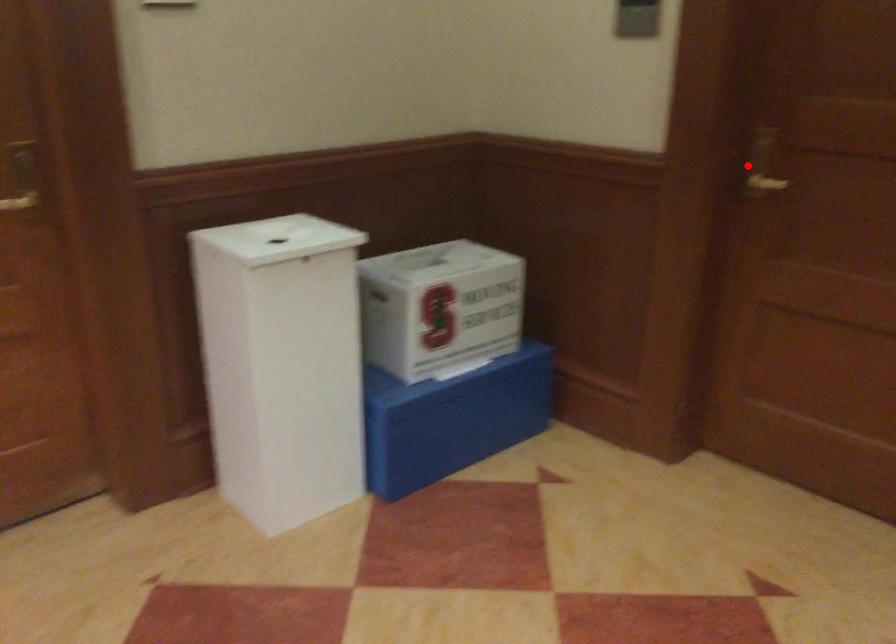
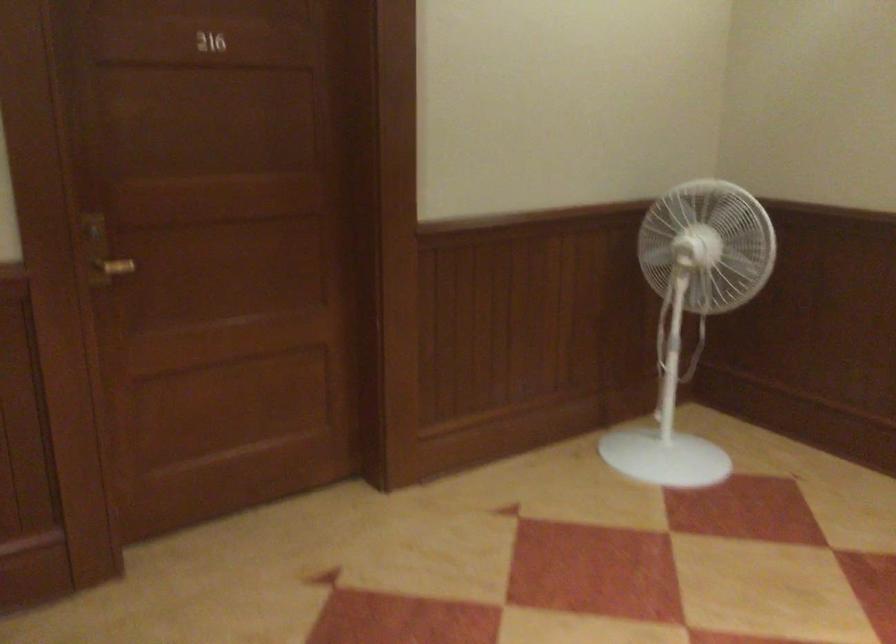
Where in the second image is the point corresponding to the highlighted location from the first image?

(101, 252)